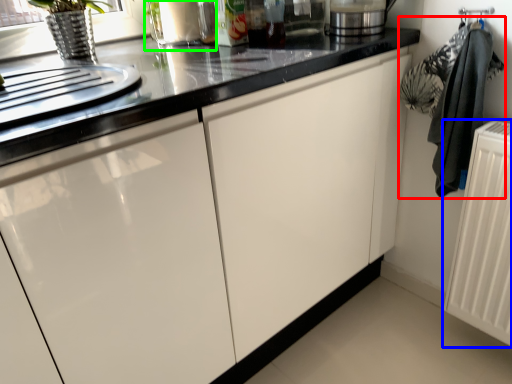
Question: Considering the real-world distances, which object is farthest from laundry (highlighted by a red box)? radiator (highlighted by a blue box) or appliance (highlighted by a green box)?

Choices:
 (A) radiator
 (B) appliance

Answer: (B)